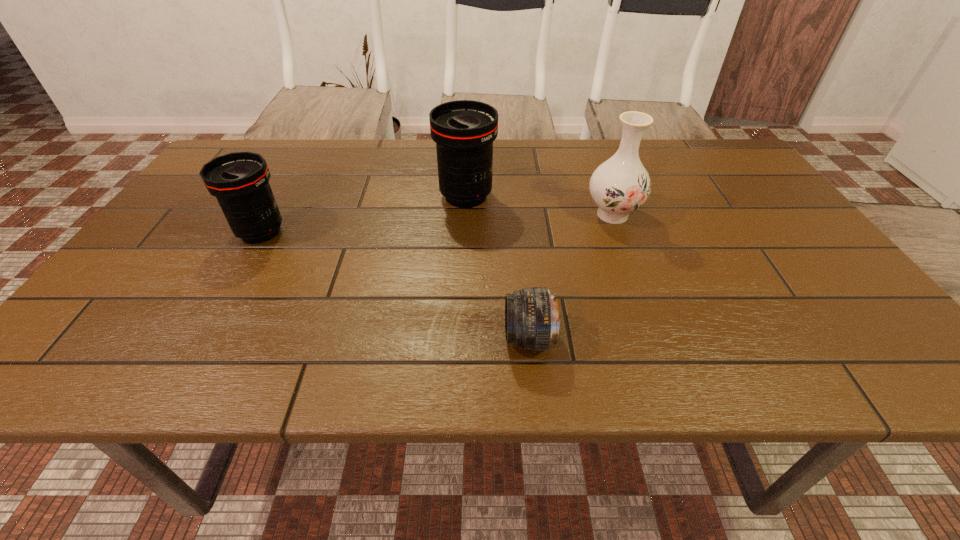
Locate an element on the screen. The width and height of the screenshot is (960, 540). telephoto lens that is the second closest one to the nearest object is located at coordinates point(240,181).

Choose which telephoto lens is the nearest neighbor to the second farthest telephoto lens. Please provide its 2D coordinates. Your answer should be formatted as a tuple, i.e. [(x, y)], where the tuple contains the x and y coordinates of a point satisfying the conditions above.

[(464, 130)]

Image resolution: width=960 pixels, height=540 pixels. Identify the location of free location that satisfies the following two spatial constraints: 1. on the front side of the vase; 2. on the right side of the second object from left to right. (465, 214).